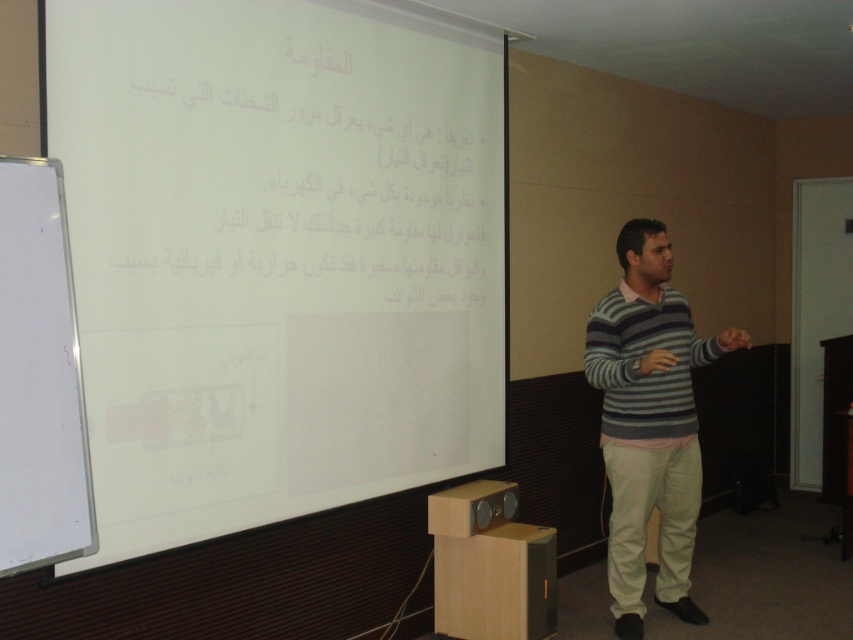
Does striped sweater at center appear on the right side of whiteboard at left?

Indeed, striped sweater at center is positioned on the right side of whiteboard at left.

What do you see at coordinates (648, 422) in the screenshot? I see `striped sweater at center` at bounding box center [648, 422].

Is point (631, 410) farther from camera compared to point (36, 252)?

Yes, point (631, 410) is farther from viewer.

You are a GUI agent. You are given a task and a screenshot of the screen. Output one action in this format:
    pyautogui.click(x=<x>, y=<y>)
    Task: Click on the striped sweater at center
    This screenshot has height=640, width=853.
    Given the screenshot: What is the action you would take?
    [x=648, y=422]